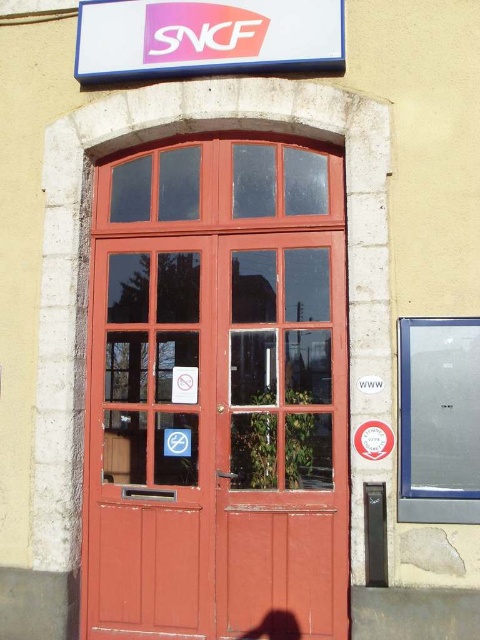
Consider the image. Who is lower down, smooth wood door at center or pink plastic sign at upper center?

smooth wood door at center

Is smooth wood door at center in front of pink plastic sign at upper center?

Yes.

The width and height of the screenshot is (480, 640). Find the location of `smooth wood door at center`. smooth wood door at center is located at coordinates (217, 396).

In order to click on smooth wood door at center in this screenshot , I will do `click(217, 396)`.